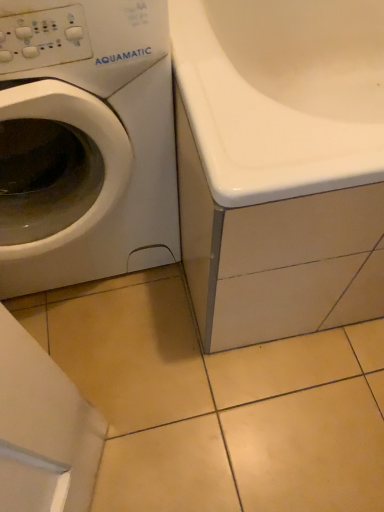
Question: From a real-world perspective, is white glossy bathtub at center physically located above or below white matte washing machine at left?

Choices:
 (A) below
 (B) above

Answer: (A)

Question: Considering the relative positions of white glossy bathtub at center and white matte washing machine at left in the image provided, is white glossy bathtub at center to the left or to the right of white matte washing machine at left?

Choices:
 (A) right
 (B) left

Answer: (A)

Question: Looking at their shapes, would you say white glossy bathtub at center is wider or thinner than white matte washing machine at left?

Choices:
 (A) wide
 (B) thin

Answer: (A)

Question: From the image's perspective, relative to white glossy bathtub at center, is white matte washing machine at left above or below?

Choices:
 (A) above
 (B) below

Answer: (B)

Question: Is white matte washing machine at left bigger or smaller than white glossy bathtub at center?

Choices:
 (A) big
 (B) small

Answer: (B)

Question: Considering the positions of white matte washing machine at left and white glossy bathtub at center in the image, is white matte washing machine at left taller or shorter than white glossy bathtub at center?

Choices:
 (A) tall
 (B) short

Answer: (A)

Question: Considering their positions, is white matte washing machine at left located in front of or behind white glossy bathtub at center?

Choices:
 (A) behind
 (B) front

Answer: (B)